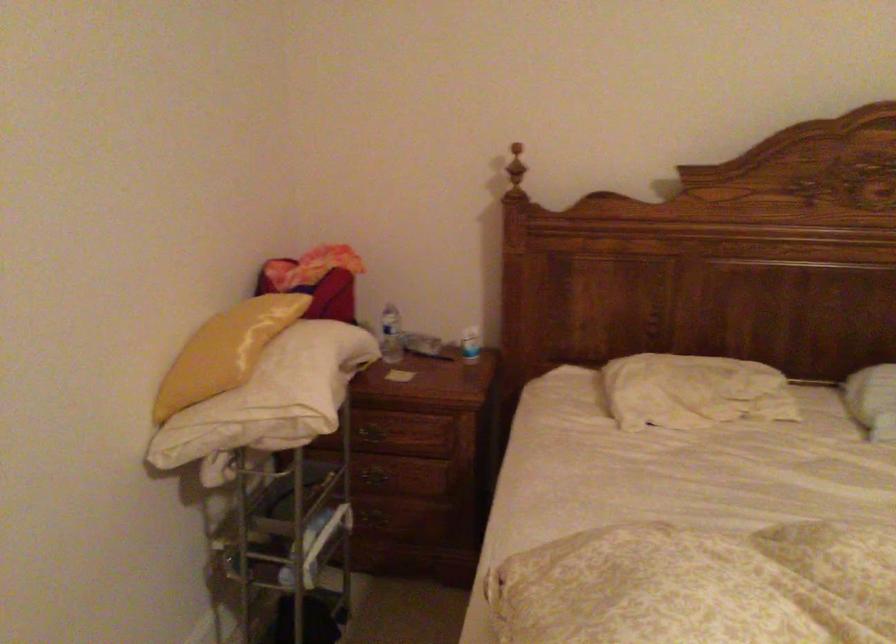
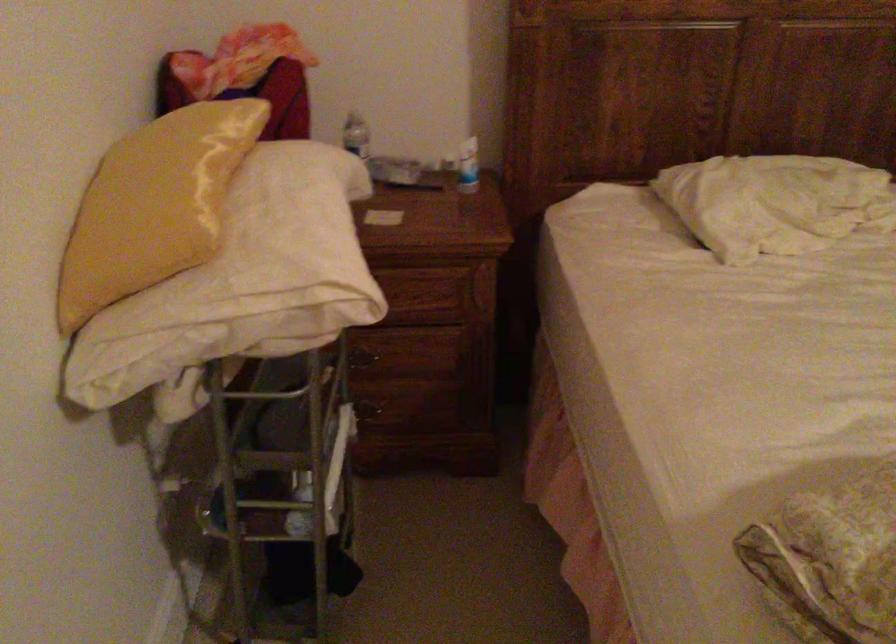
Find the pixel in the second image that matches (x=412, y=488) in the first image.

(412, 365)